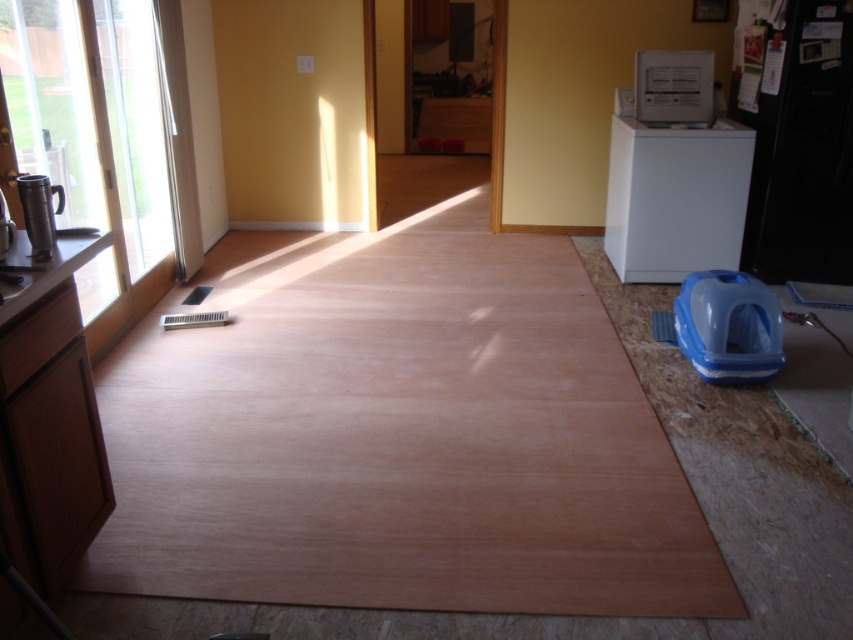
Question: Does white glossy dishwasher at upper right appear on the right side of metallic silver thermos at left?

Choices:
 (A) no
 (B) yes

Answer: (B)

Question: Which object is positioned farthest from the blue plastic dish washer at lower right?

Choices:
 (A) metallic silver thermos at left
 (B) metallic silver coffee pot at left
 (C) light brown wood at center
 (D) white glossy dishwasher at upper right

Answer: (B)

Question: Does white glossy dishwasher at upper right have a larger size compared to metallic silver coffee pot at left?

Choices:
 (A) no
 (B) yes

Answer: (B)

Question: Can you confirm if light brown wood at center is wider than blue plastic dish washer at lower right?

Choices:
 (A) no
 (B) yes

Answer: (B)

Question: Based on their relative distances, which object is farther from the blue plastic dish washer at lower right?

Choices:
 (A) light brown wood at center
 (B) metallic silver thermos at left
 (C) white glossy dishwasher at upper right

Answer: (B)

Question: Which point is farther to the camera?

Choices:
 (A) metallic silver thermos at left
 (B) white glossy dishwasher at upper right
 (C) light brown wood at center

Answer: (B)